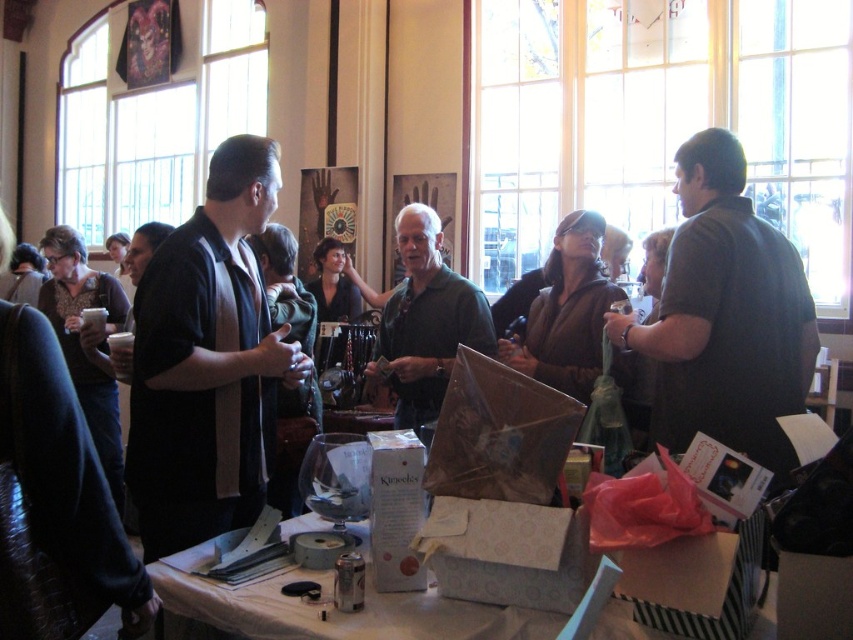
You are organizing a clothing display and need to place the black matte shirt at center and the dark green shirt at upper right. The store requires that shirts must be at least 1.5 meters apart for visibility. Can you place them as per the current arrangement?

The black matte shirt at center and the dark green shirt at upper right are currently 1.40 meters apart from each other. Since the required distance is 1.5 meters, they are too close. You need to move them further apart to meet the store requirement.

You are organizing a clothing display and need to arrange two shirts from the image. The black matte shirt at center and the dark green shirt at upper right. According to their positions in the image, which shirt should you place on the left side of the display?

The black matte shirt at center should be placed on the left side of the display because it is positioned to the left of the dark green shirt at upper right in the image.